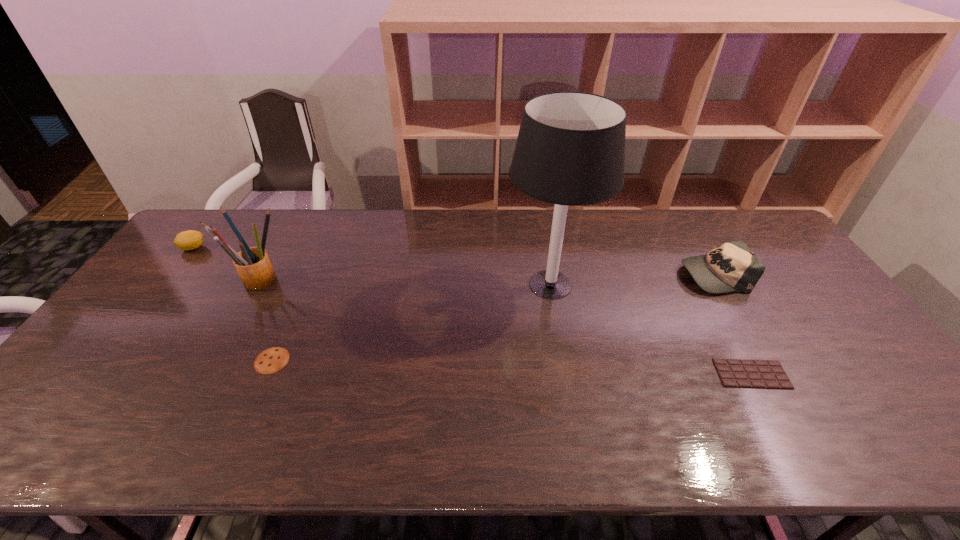
Identify the location of vacant space that satisfies the following two spatial constraints: 1. at the stem end of the lemon; 2. on the back side of the chocolate bar. The height and width of the screenshot is (540, 960). (95, 374).

The image size is (960, 540). In order to click on free location that satisfies the following two spatial constraints: 1. at the stem end of the fifth tallest object; 2. on the right side of the third shortest object in this screenshot , I will do coord(106,361).

Locate an element on the screen. The height and width of the screenshot is (540, 960). vacant space that satisfies the following two spatial constraints: 1. on the back side of the fifth tallest object; 2. at the stem end of the leftmost object is located at coordinates click(x=321, y=248).